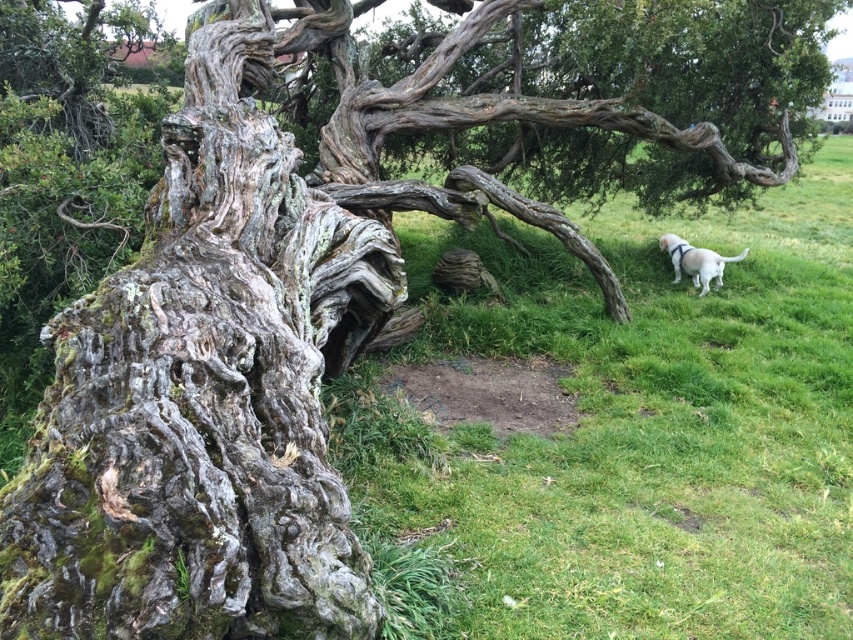
Question: Considering the real-world distances, which object is closest to the white matte dog at right?

Choices:
 (A) green grassy at center
 (B) gray rough bark tree trunk at left

Answer: (A)

Question: Does gray rough bark tree trunk at left have a smaller size compared to white matte dog at right?

Choices:
 (A) no
 (B) yes

Answer: (A)

Question: Considering the real-world distances, which object is closest to the green grassy at center?

Choices:
 (A) white matte dog at right
 (B) gray rough bark tree trunk at left

Answer: (B)

Question: Does gray rough bark tree trunk at left appear over white matte dog at right?

Choices:
 (A) yes
 (B) no

Answer: (B)

Question: Can you confirm if gray rough bark tree trunk at left is thinner than white matte dog at right?

Choices:
 (A) no
 (B) yes

Answer: (A)

Question: Among these objects, which one is farthest from the camera?

Choices:
 (A) white matte dog at right
 (B) green grassy at center
 (C) gray rough bark tree trunk at left

Answer: (A)